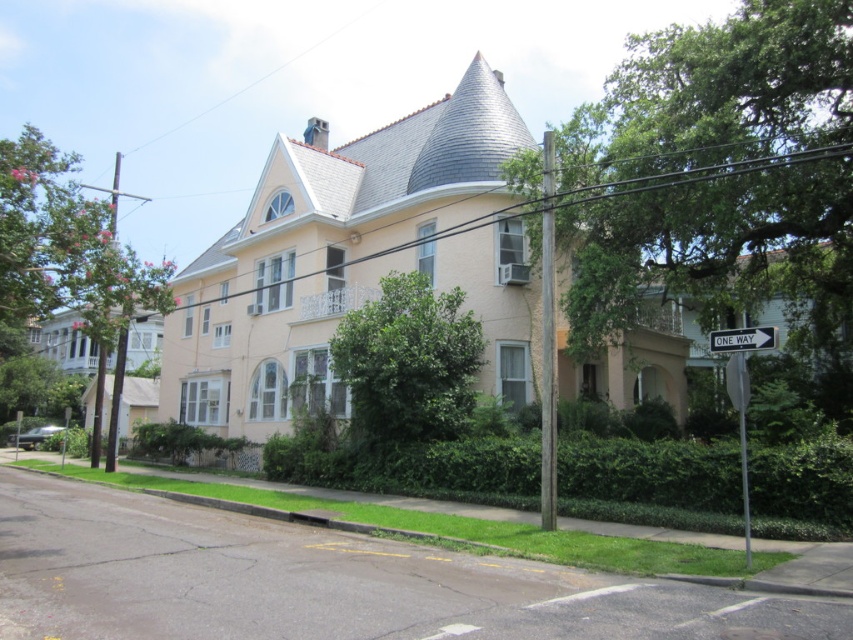
Can you confirm if green leafy hedge at lower center is taller than pink textured tree at left?

No, green leafy hedge at lower center is not taller than pink textured tree at left.

Is green leafy hedge at lower center in front of pink textured tree at left?

Yes, it is in front of pink textured tree at left.

You are a GUI agent. You are given a task and a screenshot of the screen. Output one action in this format:
    pyautogui.click(x=<x>, y=<y>)
    Task: Click on the green leafy hedge at lower center
    The width and height of the screenshot is (853, 640).
    Given the screenshot: What is the action you would take?
    pyautogui.click(x=651, y=483)

Does green leafy tree at upper center appear under green leafy tree at center?

No.

Is green leafy tree at upper center thinner than green leafy tree at center?

No.

Between point (628, 289) and point (450, 416), which one is positioned in front?

Positioned in front is point (628, 289).

Locate an element on the screen. This screenshot has height=640, width=853. green leafy tree at upper center is located at coordinates (724, 259).

Is green leafy hedge at lower center to the right of white plastic sign at center right from the viewer's perspective?

Incorrect, green leafy hedge at lower center is not on the right side of white plastic sign at center right.

Is point (786, 477) farther from viewer compared to point (770, 337)?

That is True.

Is point (781, 508) positioned before point (764, 340)?

No, (781, 508) is further to viewer.

Identify the location of green leafy hedge at lower center. The width and height of the screenshot is (853, 640). (651, 483).